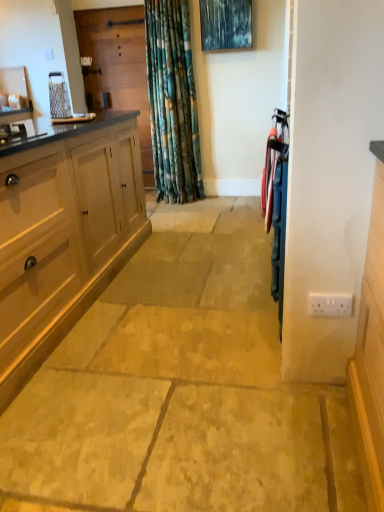
Find the location of a particular element. Image resolution: width=384 pixels, height=512 pixels. vacant space to the left of metallic blue screen door at right, marked as the second screen door in a back-to-front arrangement is located at coordinates (269, 387).